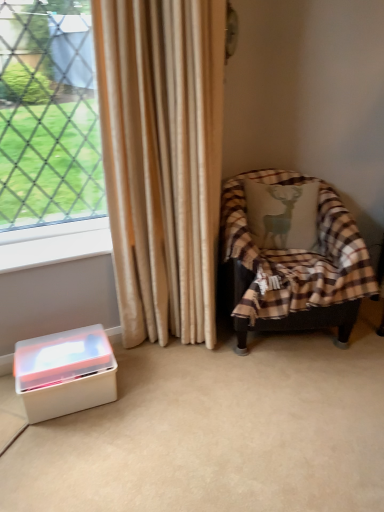
Question: Does white plastic at lower left have a larger size compared to plaid fabric chair at right?

Choices:
 (A) yes
 (B) no

Answer: (B)

Question: Are white plastic at lower left and plaid fabric chair at right beside each other?

Choices:
 (A) no
 (B) yes

Answer: (A)

Question: Does white plastic at lower left have a greater height compared to plaid fabric chair at right?

Choices:
 (A) yes
 (B) no

Answer: (B)

Question: Are white plastic at lower left and plaid fabric chair at right located far from each other?

Choices:
 (A) yes
 (B) no

Answer: (B)

Question: Does white plastic at lower left have a lesser height compared to plaid fabric chair at right?

Choices:
 (A) no
 (B) yes

Answer: (B)

Question: Is the position of white plastic at lower left more distant than that of plaid fabric chair at right?

Choices:
 (A) yes
 (B) no

Answer: (A)

Question: Does beige silk curtain at center have a greater height compared to white plastic container at lower left?

Choices:
 (A) no
 (B) yes

Answer: (B)

Question: Does beige silk curtain at center appear on the left side of white plastic container at lower left?

Choices:
 (A) no
 (B) yes

Answer: (A)

Question: From the image's perspective, is beige silk curtain at center below white plastic container at lower left?

Choices:
 (A) no
 (B) yes

Answer: (A)

Question: Would you say beige silk curtain at center is outside white plastic container at lower left?

Choices:
 (A) no
 (B) yes

Answer: (B)

Question: Considering the relative positions of beige silk curtain at center and white plastic container at lower left in the image provided, is beige silk curtain at center in front of white plastic container at lower left?

Choices:
 (A) yes
 (B) no

Answer: (A)

Question: Considering the relative sizes of beige silk curtain at center and white plastic container at lower left in the image provided, is beige silk curtain at center shorter than white plastic container at lower left?

Choices:
 (A) no
 (B) yes

Answer: (A)

Question: Considering the relative sizes of plaid fabric chair at right and white plastic container at lower left in the image provided, is plaid fabric chair at right wider than white plastic container at lower left?

Choices:
 (A) yes
 (B) no

Answer: (A)